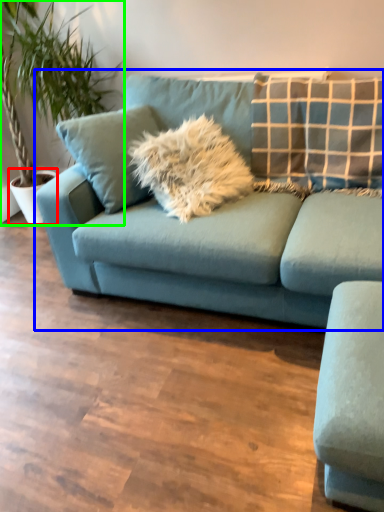
Question: Estimate the real-world distances between objects in this image. Which object is closer to flowerpot (highlighted by a red box), studio couch (highlighted by a blue box) or houseplant (highlighted by a green box)?

Choices:
 (A) studio couch
 (B) houseplant

Answer: (B)